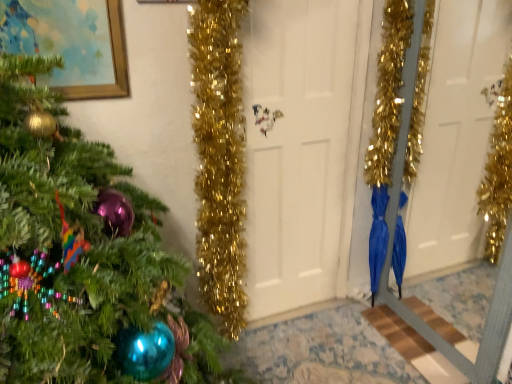
Question: Considering their positions, is blue glossy umbrella at lower right located in front of or behind white matte door at center?

Choices:
 (A) behind
 (B) front

Answer: (A)

Question: Considering the positions of blue glossy umbrella at lower right and white matte door at center in the image, is blue glossy umbrella at lower right bigger or smaller than white matte door at center?

Choices:
 (A) big
 (B) small

Answer: (B)

Question: Based on their relative distances, which object is nearer to the white matte door at center?

Choices:
 (A) gold-framed painting at upper left
 (B) blue glossy umbrella at lower right
 (C) green matte christmas tree at left

Answer: (B)

Question: Based on their relative distances, which object is farther from the green matte christmas tree at left?

Choices:
 (A) white matte door at center
 (B) gold-framed painting at upper left
 (C) blue glossy umbrella at lower right

Answer: (C)